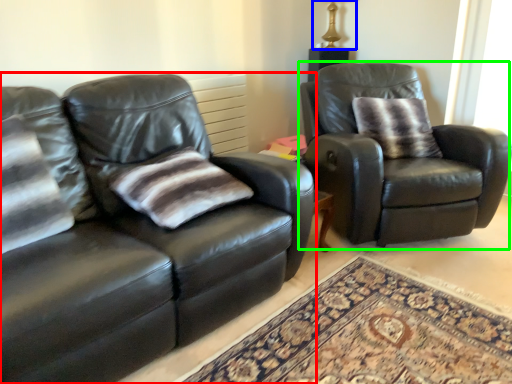
Question: Based on their relative distances, which object is farther from studio couch (highlighted by a red box)? Choose from table lamp (highlighted by a blue box) and chair (highlighted by a green box).

Choices:
 (A) table lamp
 (B) chair

Answer: (A)